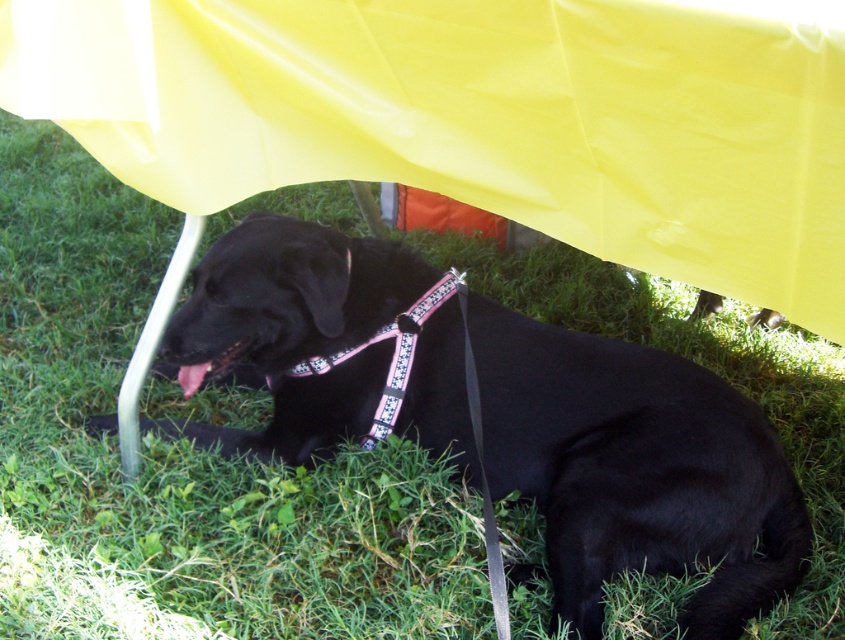
Question: Which point is closer to the camera?

Choices:
 (A) (466, 358)
 (B) (371, 397)

Answer: (A)

Question: Which object is farther from the camera taking this photo?

Choices:
 (A) pink fabric neckband at center
 (B) black fabric dog at center

Answer: (A)

Question: Does black fabric dog at center have a smaller size compared to pink fabric neckband at center?

Choices:
 (A) no
 (B) yes

Answer: (A)

Question: Is black fabric dog at center positioned in front of pink fabric neckband at center?

Choices:
 (A) yes
 (B) no

Answer: (A)

Question: Is black fabric dog at center smaller than pink fabric neckband at center?

Choices:
 (A) yes
 (B) no

Answer: (B)